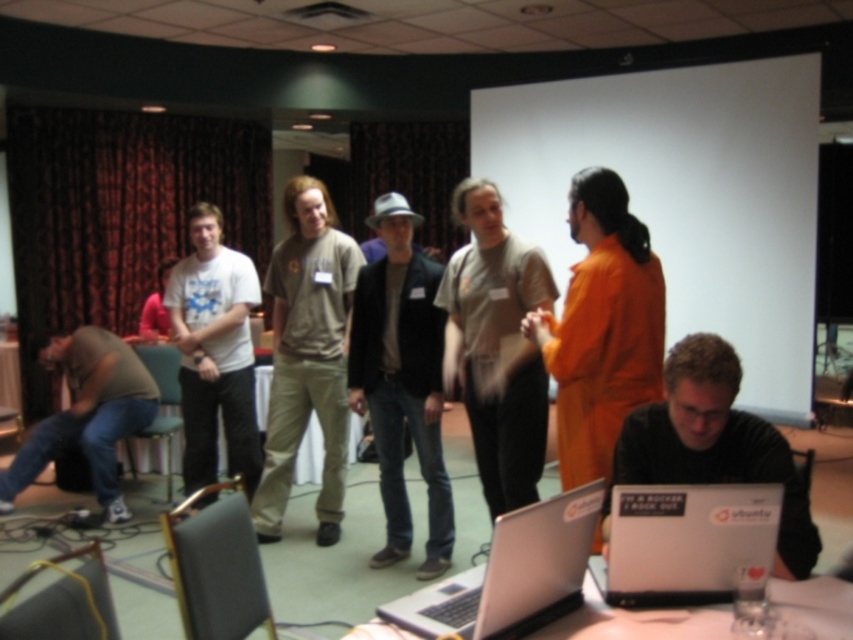
Is white matte t-shirt at center positioned behind matte brown shirt at lower left?

No, white matte t-shirt at center is in front of matte brown shirt at lower left.

Measure the distance between white matte t-shirt at center and camera.

white matte t-shirt at center is 3.80 meters away from camera.

Identify the location of white matte t-shirt at center. (213, 352).

Is matte khaki pants at center thinner than silver metallic laptop at lower center?

Incorrect, matte khaki pants at center's width is not less than silver metallic laptop at lower center's.

Which of these two, matte khaki pants at center or silver metallic laptop at lower center, stands shorter?

silver metallic laptop at lower center

Does point (326, 435) come closer to viewer compared to point (579, 490)?

No.

Locate an element on the screen. The image size is (853, 640). matte khaki pants at center is located at coordinates (306, 355).

Describe the element at coordinates (401, 380) in the screenshot. I see `denim jacket at center` at that location.

Does point (376, 436) lie in front of point (294, 346)?

Yes, it is in front of point (294, 346).

I want to click on denim jacket at center, so click(x=401, y=380).